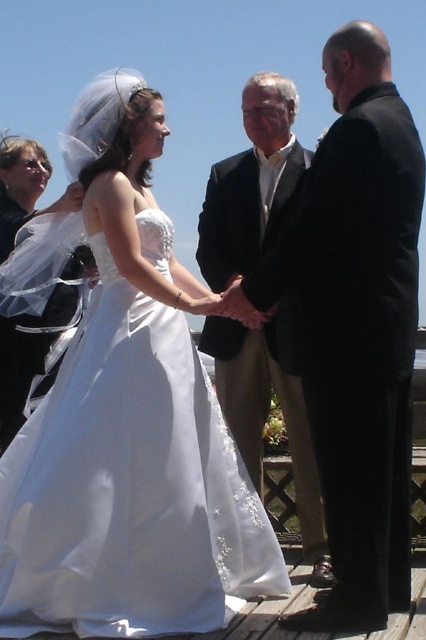
Does white satin dress at center appear on the right side of translucent satin veil at upper left?

Correct, you'll find white satin dress at center to the right of translucent satin veil at upper left.

This screenshot has width=426, height=640. In order to click on white satin dress at center in this screenshot , I will do `click(123, 416)`.

Image resolution: width=426 pixels, height=640 pixels. Find the location of `white satin dress at center`. white satin dress at center is located at coordinates (123, 416).

Consider the image. Who is more forward, (363, 275) or (284, 188)?

Point (363, 275)

This screenshot has height=640, width=426. Find the location of `light beige cotton suit at center`. light beige cotton suit at center is located at coordinates (356, 326).

The width and height of the screenshot is (426, 640). In order to click on white satin dress at center in this screenshot , I will do `click(123, 416)`.

Who is more distant from viewer, (166, 364) or (259, 488)?

The point (259, 488) is more distant.

Identify the location of white satin dress at center. The height and width of the screenshot is (640, 426). (123, 416).